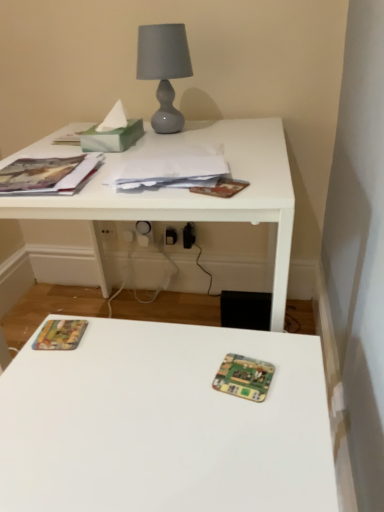
Question: Is green marbled tissue at upper left bigger than matte gray glass table lamp at upper center?

Choices:
 (A) no
 (B) yes

Answer: (A)

Question: Could you tell me if green marbled tissue at upper left is turned towards matte gray glass table lamp at upper center?

Choices:
 (A) yes
 (B) no

Answer: (B)

Question: From a real-world perspective, does green marbled tissue at upper left stand above matte gray glass table lamp at upper center?

Choices:
 (A) yes
 (B) no

Answer: (B)

Question: From the image's perspective, is green marbled tissue at upper left located above matte gray glass table lamp at upper center?

Choices:
 (A) yes
 (B) no

Answer: (B)

Question: Considering the relative sizes of green marbled tissue at upper left and matte gray glass table lamp at upper center in the image provided, is green marbled tissue at upper left smaller than matte gray glass table lamp at upper center?

Choices:
 (A) yes
 (B) no

Answer: (A)

Question: Considering the positions of white glossy table at upper center and multicolored paper at lower left, acting as the first paperback book starting from the bottom, in the image, is white glossy table at upper center bigger or smaller than multicolored paper at lower left, acting as the first paperback book starting from the bottom,?

Choices:
 (A) small
 (B) big

Answer: (B)

Question: Is point (77, 263) positioned closer to the camera than point (38, 346)?

Choices:
 (A) farther
 (B) closer

Answer: (A)

Question: From the image's perspective, relative to multicolored paper at lower left, acting as the first paperback book starting from the bottom, is white glossy table at upper center above or below?

Choices:
 (A) above
 (B) below

Answer: (A)

Question: Considering their positions, is white glossy table at upper center located in front of or behind multicolored paper at lower left, acting as the first paperback book starting from the bottom?

Choices:
 (A) front
 (B) behind

Answer: (A)

Question: In terms of size, does multicolored paper at lower left, acting as the first paperback book starting from the bottom, appear bigger or smaller than wooden printed card game at center?

Choices:
 (A) big
 (B) small

Answer: (B)

Question: Which is correct: multicolored paper at lower left, acting as the first paperback book starting from the bottom, is inside wooden printed card game at center, or outside of it?

Choices:
 (A) outside
 (B) inside

Answer: (A)

Question: Would you say multicolored paper at lower left, acting as the first paperback book starting from the bottom, is to the left or to the right of wooden printed card game at center in the picture?

Choices:
 (A) left
 (B) right

Answer: (A)

Question: Considering their positions, is multicolored paper at lower left, the 2th paperback book when ordered from top to bottom, located in front of or behind wooden printed card game at center?

Choices:
 (A) front
 (B) behind

Answer: (B)

Question: Does point (225, 361) appear closer or farther from the camera than point (178, 155)?

Choices:
 (A) farther
 (B) closer

Answer: (B)

Question: Is wooden printed card game at center to the left or to the right of white paper at center in the image?

Choices:
 (A) right
 (B) left

Answer: (A)